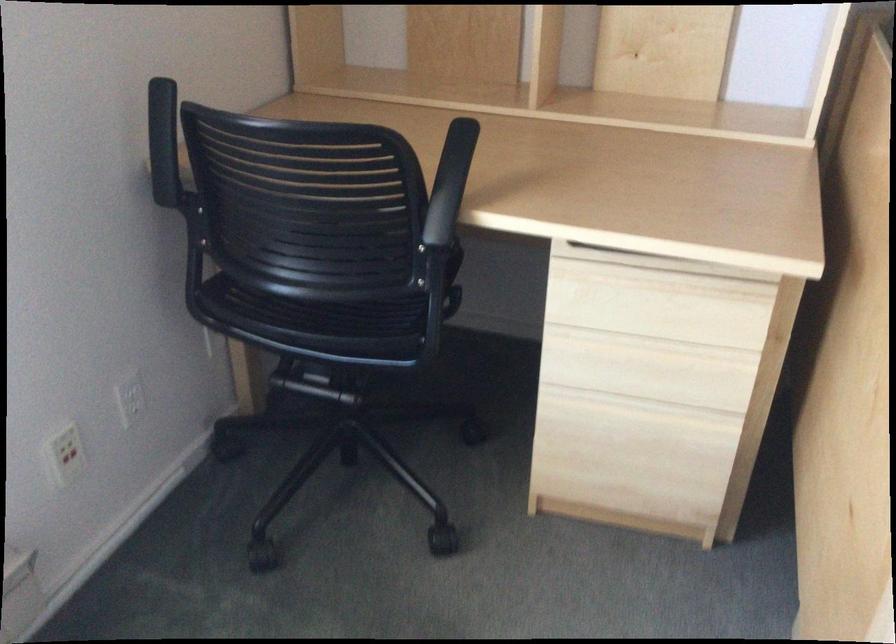
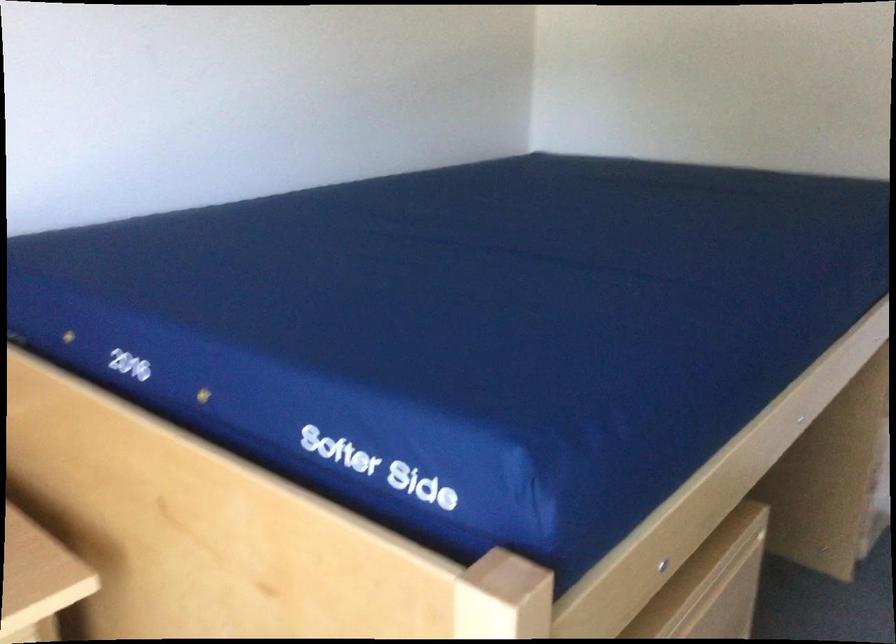
Question: The camera is either moving clockwise (left) or counter-clockwise (right) around the object. The first image is from the beginning of the video and the second image is from the end. Is the camera moving left or right when shooting the video?

Choices:
 (A) Left
 (B) Right

Answer: (A)